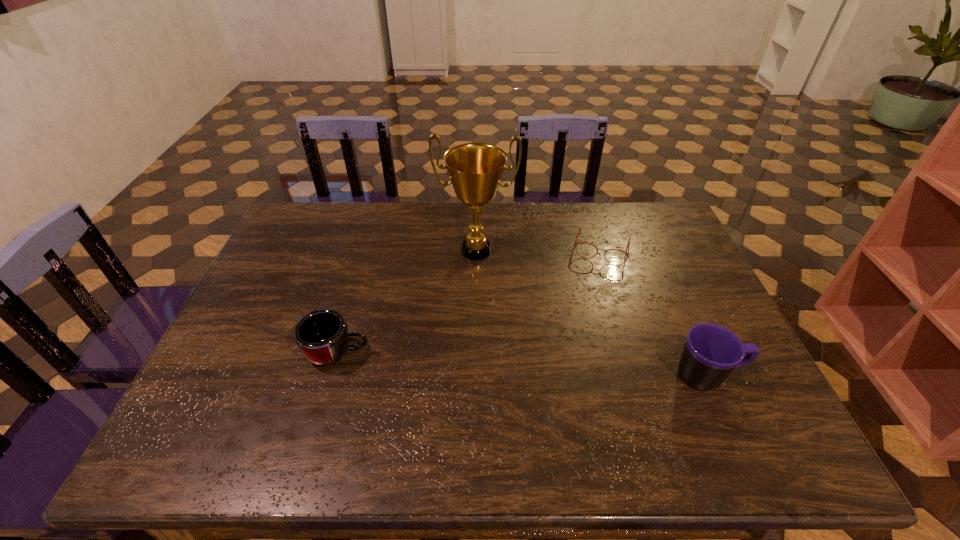
Where is `the second shortest object`? the second shortest object is located at coordinates (322, 336).

I want to click on the leftmost object, so click(322, 336).

I want to click on the taller mug, so click(x=711, y=352).

At what (x,y) coordinates should I click in order to perform the action: click on the second tallest object. Please return your answer as a coordinate pair (x, y). Looking at the image, I should click on (711, 352).

Locate an element on the screen. This screenshot has height=540, width=960. spectacles is located at coordinates (579, 228).

Identify the location of the third object from right to left. The width and height of the screenshot is (960, 540). (475, 169).

What are the coordinates of `award` in the screenshot? It's located at (475, 169).

Image resolution: width=960 pixels, height=540 pixels. Identify the location of vacant area located on the side of the third tallest object with the handle. (485, 353).

At what (x,y) coordinates should I click in order to perform the action: click on vacant space located 0.260m on the face of the spectacles. Please return your answer as a coordinate pair (x, y). Image resolution: width=960 pixels, height=540 pixels. Looking at the image, I should click on (581, 327).

Locate an element on the screen. free space located on the face of the spectacles is located at coordinates (593, 277).